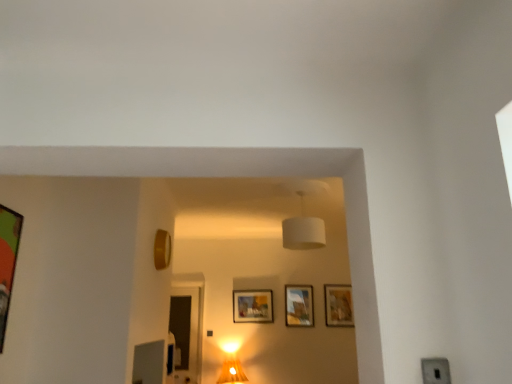
You are a GUI agent. You are given a task and a screenshot of the screen. Output one action in this format:
    pyautogui.click(x=<x>, y=<y>)
    Task: Click on the matte wooden picture frame at center, which appears as the 3th picture frame when viewed from the back
    The width and height of the screenshot is (512, 384).
    Given the screenshot: What is the action you would take?
    pyautogui.click(x=253, y=306)

Measure the distance between point (163, 243) and camera.

13.49 feet.

Where is `matte wooden picture frame at center, which is the 2th picture frame from back to front`? This screenshot has height=384, width=512. matte wooden picture frame at center, which is the 2th picture frame from back to front is located at coordinates (298, 305).

Find the location of `matte gold table lamp at center`. matte gold table lamp at center is located at coordinates (231, 366).

Identify the location of white fabric lampshade at center. This screenshot has width=512, height=384. (303, 231).

From the image's perspective, starting from the transparent glass door at center, which picture frame is the 1st one above? Please provide its 2D coordinates.

[(253, 306)]

Looking at this image, from a real-world perspective, between transparent glass door at center and matte wooden picture frame at center, positioned as the 3th picture frame in right-to-left order, who is vertically higher?

matte wooden picture frame at center, positioned as the 3th picture frame in right-to-left order, is physically above.

Which of these two, transparent glass door at center or matte wooden picture frame at center, marked as the 3th picture frame in a front-to-back arrangement, is wider?

With larger width is transparent glass door at center.

How different are the orientations of transparent glass door at center and matte wooden picture frame at center, which appears as the 3th picture frame when viewed from the back, in degrees?

0.00757 degrees.

Which is nearer, (256, 298) or (157, 268)?

Positioned in front is point (157, 268).

From a real-world perspective, is matte wooden picture frame at center, which appears as the 3th picture frame when viewed from the back, below gold metallic picture frame at upper center, which ranks as the 4th picture frame in back-to-front order?

Yes, from a real-world perspective, matte wooden picture frame at center, which appears as the 3th picture frame when viewed from the back, is below gold metallic picture frame at upper center, which ranks as the 4th picture frame in back-to-front order.

From the image's perspective, which is above, matte wooden picture frame at center, positioned as the 3th picture frame in right-to-left order, or gold metallic picture frame at upper center, which ranks as the 4th picture frame in back-to-front order?

gold metallic picture frame at upper center, which ranks as the 4th picture frame in back-to-front order.

Consider the image. Which object is closer to the camera taking this photo, wooden textured picture frame at right, the 1th picture frame viewed from the right, or green matte picture frame at left, arranged as the fifth picture frame when viewed from the back?

green matte picture frame at left, arranged as the fifth picture frame when viewed from the back.

From a real-world perspective, is wooden textured picture frame at right, marked as the 1th picture frame in a back-to-front arrangement, positioned above or below green matte picture frame at left, arranged as the fifth picture frame when viewed from the back?

Clearly, from a real-world perspective, wooden textured picture frame at right, marked as the 1th picture frame in a back-to-front arrangement, is below green matte picture frame at left, arranged as the fifth picture frame when viewed from the back.

Which of these two, gold metallic picture frame at upper center, which ranks as the 4th picture frame in back-to-front order, or green matte picture frame at left, acting as the first picture frame starting from the left, is thinner?

With smaller width is green matte picture frame at left, acting as the first picture frame starting from the left.

Is gold metallic picture frame at upper center, which ranks as the 4th picture frame in back-to-front order, directly adjacent to green matte picture frame at left, the 1th picture frame positioned from the front?

No, gold metallic picture frame at upper center, which ranks as the 4th picture frame in back-to-front order, is not in contact with green matte picture frame at left, the 1th picture frame positioned from the front.

Is gold metallic picture frame at upper center, the fourth picture frame from the right, taller than green matte picture frame at left, arranged as the fifth picture frame when viewed from the right?

No.

Is gold metallic picture frame at upper center, arranged as the second picture frame when viewed from the front, not within green matte picture frame at left, arranged as the fifth picture frame when viewed from the back?

gold metallic picture frame at upper center, arranged as the second picture frame when viewed from the front, is positioned outside green matte picture frame at left, arranged as the fifth picture frame when viewed from the back.

Considering the sizes of wooden textured picture frame at right, the 1th picture frame viewed from the right, and gold metallic picture frame at upper center, which appears as the 2th picture frame when viewed from the left, in the image, is wooden textured picture frame at right, the 1th picture frame viewed from the right, wider or thinner than gold metallic picture frame at upper center, which appears as the 2th picture frame when viewed from the left,?

Considering their sizes, wooden textured picture frame at right, the 1th picture frame viewed from the right, looks slimmer than gold metallic picture frame at upper center, which appears as the 2th picture frame when viewed from the left.

Starting from the wooden textured picture frame at right, marked as the 5th picture frame in a left-to-right arrangement, which picture frame is the 3rd one in front? Please provide its 2D coordinates.

[(162, 249)]

Which is in front, wooden textured picture frame at right, the fifth picture frame viewed from the front, or gold metallic picture frame at upper center, the fourth picture frame from the right?

gold metallic picture frame at upper center, the fourth picture frame from the right.

Based on the photo, is wooden textured picture frame at right, the 1th picture frame viewed from the right, touching gold metallic picture frame at upper center, which appears as the 2th picture frame when viewed from the left?

They are not placed beside each other.

Between matte wooden picture frame at center, which is the 2th picture frame from back to front, and gold metallic picture frame at upper center, which appears as the 2th picture frame when viewed from the left, which one has smaller width?

Thinner between the two is matte wooden picture frame at center, which is the 2th picture frame from back to front.

Considering the relative positions of matte wooden picture frame at center, marked as the fourth picture frame in a front-to-back arrangement, and gold metallic picture frame at upper center, arranged as the second picture frame when viewed from the front, in the image provided, is matte wooden picture frame at center, marked as the fourth picture frame in a front-to-back arrangement, to the right of gold metallic picture frame at upper center, arranged as the second picture frame when viewed from the front, from the viewer's perspective?

Correct, you'll find matte wooden picture frame at center, marked as the fourth picture frame in a front-to-back arrangement, to the right of gold metallic picture frame at upper center, arranged as the second picture frame when viewed from the front.

From the image's perspective, does matte wooden picture frame at center, acting as the 4th picture frame starting from the left, appear lower than gold metallic picture frame at upper center, which appears as the 2th picture frame when viewed from the left?

Indeed, from the image's perspective, matte wooden picture frame at center, acting as the 4th picture frame starting from the left, is shown beneath gold metallic picture frame at upper center, which appears as the 2th picture frame when viewed from the left.

Are matte wooden picture frame at center, acting as the 4th picture frame starting from the left, and gold metallic picture frame at upper center, which ranks as the 4th picture frame in back-to-front order, located far from each other?

Yes, matte wooden picture frame at center, acting as the 4th picture frame starting from the left, and gold metallic picture frame at upper center, which ranks as the 4th picture frame in back-to-front order, are quite far apart.

Would you say wooden textured picture frame at right, the 1th picture frame viewed from the right, is inside or outside matte wooden picture frame at center, positioned as the 3th picture frame in right-to-left order?

The correct answer is: outside.

Looking at the image, does wooden textured picture frame at right, the 1th picture frame viewed from the right, seem bigger or smaller compared to matte wooden picture frame at center, positioned as the 3th picture frame in right-to-left order?

In the image, wooden textured picture frame at right, the 1th picture frame viewed from the right, appears to be smaller than matte wooden picture frame at center, positioned as the 3th picture frame in right-to-left order.

From the picture: Is wooden textured picture frame at right, the fifth picture frame viewed from the front, facing away from matte wooden picture frame at center, positioned as the 3th picture frame in right-to-left order?

No.

This screenshot has width=512, height=384. In order to click on glass door in front of the matte wooden picture frame at center, positioned as the 3th picture frame in right-to-left order in this screenshot , I will do (187, 331).

From the image's perspective, starting from the matte wooden picture frame at center, positioned as the 3th picture frame in right-to-left order, which picture frame is the 3rd one above? Please provide its 2D coordinates.

[(162, 249)]

Based on the photo, estimate the real-world distances between objects in this image. Which object is closer to green matte picture frame at left, the 1th picture frame positioned from the front, gold metallic picture frame at upper center, the fourth picture frame from the right, or matte wooden picture frame at center, acting as the 4th picture frame starting from the left?

gold metallic picture frame at upper center, the fourth picture frame from the right, is closer to green matte picture frame at left, the 1th picture frame positioned from the front.

Considering their positions, is white fabric lampshade at center positioned closer to matte wooden picture frame at center, which is the 2th picture frame from back to front, than green matte picture frame at left, arranged as the fifth picture frame when viewed from the back?

The object closer to matte wooden picture frame at center, which is the 2th picture frame from back to front, is white fabric lampshade at center.

Looking at the image, which one is located closer to green matte picture frame at left, the 1th picture frame positioned from the front, white fabric lampshade at center or gold metallic picture frame at upper center, which appears as the 2th picture frame when viewed from the left?

gold metallic picture frame at upper center, which appears as the 2th picture frame when viewed from the left.

From the image, which object appears to be farther from matte wooden picture frame at center, acting as the 4th picture frame starting from the left, white fabric lampshade at center or matte gold table lamp at center?

white fabric lampshade at center.

Looking at this image, from the image, which object appears to be nearer to matte wooden picture frame at center, marked as the fourth picture frame in a front-to-back arrangement, wooden textured picture frame at right, the fifth picture frame viewed from the front, or matte gold table lamp at center?

The object closer to matte wooden picture frame at center, marked as the fourth picture frame in a front-to-back arrangement, is wooden textured picture frame at right, the fifth picture frame viewed from the front.

Looking at the image, which one is located further to matte gold table lamp at center, white fabric lampshade at center or matte wooden picture frame at center, positioned as the 3th picture frame in right-to-left order?

white fabric lampshade at center is further to matte gold table lamp at center.

From the image, which object appears to be farther from gold metallic picture frame at upper center, the fourth picture frame from the right, matte gold table lamp at center or wooden textured picture frame at right, marked as the 1th picture frame in a back-to-front arrangement?

Based on the image, wooden textured picture frame at right, marked as the 1th picture frame in a back-to-front arrangement, appears to be further to gold metallic picture frame at upper center, the fourth picture frame from the right.

From the image, which object appears to be nearer to gold metallic picture frame at upper center, the fourth picture frame from the right, matte gold table lamp at center or matte wooden picture frame at center, acting as the 4th picture frame starting from the left?

matte gold table lamp at center is positioned closer to the anchor gold metallic picture frame at upper center, the fourth picture frame from the right.

The height and width of the screenshot is (384, 512). What are the coordinates of `picture frame positioned between green matte picture frame at left, acting as the first picture frame starting from the left, and transparent glass door at center from near to far` in the screenshot? It's located at (162, 249).

Image resolution: width=512 pixels, height=384 pixels. Identify the location of table lamp positioned between gold metallic picture frame at upper center, which ranks as the 4th picture frame in back-to-front order, and matte wooden picture frame at center, marked as the fourth picture frame in a front-to-back arrangement, from near to far. (231, 366).

Locate an element on the screen. The width and height of the screenshot is (512, 384). glass door located between white fabric lampshade at center and matte wooden picture frame at center, positioned as the 3th picture frame in right-to-left order, in the depth direction is located at coordinates (187, 331).

At what (x,y) coordinates should I click in order to perform the action: click on table lamp between green matte picture frame at left, acting as the first picture frame starting from the left, and wooden textured picture frame at right, the fifth picture frame viewed from the front, along the z-axis. Please return your answer as a coordinate pair (x, y). Looking at the image, I should click on (231, 366).